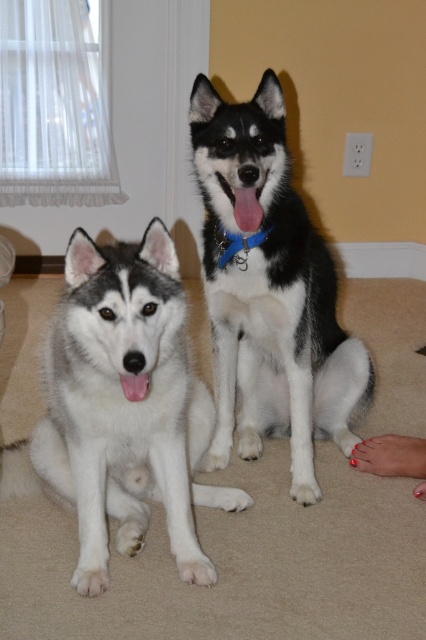
Consider the image. Does white fluffy dog at center appear under black and white fur at center?

Indeed, white fluffy dog at center is positioned under black and white fur at center.

Locate an element on the screen. white fluffy dog at center is located at coordinates (121, 408).

Is the position of white fluffy dog at center more distant than that of blue fabric neckband at center?

No, it is not.

Who is more forward, (181, 538) or (221, 228)?

Point (181, 538)

I want to click on white fluffy dog at center, so click(x=121, y=408).

Is black and white fur at center taller than blue fabric neckband at center?

Correct, black and white fur at center is much taller as blue fabric neckband at center.

Is black and white fur at center thinner than blue fabric neckband at center?

No, black and white fur at center is not thinner than blue fabric neckband at center.

Is point (233, 353) farther from viewer compared to point (250, 243)?

Yes, it is.

Image resolution: width=426 pixels, height=640 pixels. I want to click on black and white fur at center, so click(270, 292).